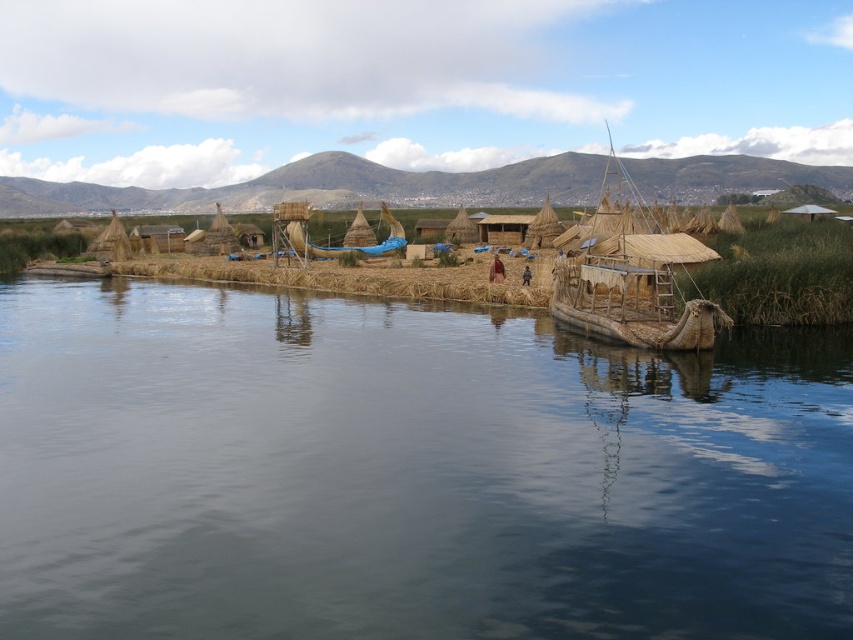
Question: Is dark blue water at lower center closer to the viewer compared to natural woven reed boat at center?

Choices:
 (A) no
 (B) yes

Answer: (B)

Question: Which of the following is the farthest from the observer?

Choices:
 (A) dark blue water at lower center
 (B) blue fabric boat at center

Answer: (B)

Question: Estimate the real-world distances between objects in this image. Which object is closer to the blue fabric boat at center?

Choices:
 (A) natural woven reed boat at center
 (B) dark blue water at lower center

Answer: (A)

Question: Does natural woven reed boat at center appear over blue fabric boat at center?

Choices:
 (A) yes
 (B) no

Answer: (A)

Question: Does natural woven reed boat at center come behind blue fabric boat at center?

Choices:
 (A) yes
 (B) no

Answer: (B)

Question: Which point is closer to the camera?

Choices:
 (A) blue fabric boat at center
 (B) dark blue water at lower center
 (C) natural woven reed boat at center

Answer: (B)